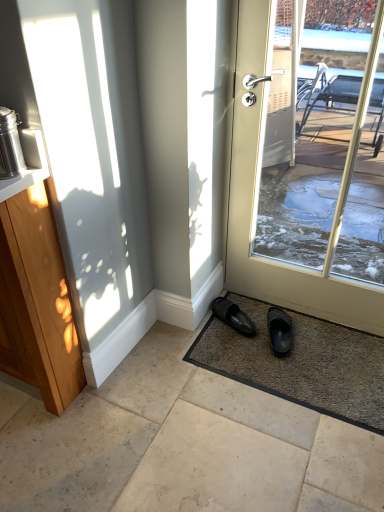
Question: Considering the positions of smooth beige tiles at center and black rubber slipper at lower center, the 2th footwear when ordered from right to left, in the image, is smooth beige tiles at center bigger or smaller than black rubber slipper at lower center, the 2th footwear when ordered from right to left,?

Choices:
 (A) small
 (B) big

Answer: (B)

Question: From a real-world perspective, is smooth beige tiles at center physically located above or below black rubber slipper at lower center, the 2th footwear when ordered from right to left?

Choices:
 (A) below
 (B) above

Answer: (A)

Question: Which object is positioned closest to the black rubber slipper at lower right, which appears as the second footwear when viewed from the left?

Choices:
 (A) stainless steel thermos at left
 (B) smooth beige tiles at center
 (C) wooden cabinet at left
 (D) matte white door at center
 (E) black rubber slipper at lower center, marked as the first footwear in a left-to-right arrangement

Answer: (E)

Question: Considering the real-world distances, which object is farthest from the black rubber slipper at lower center, the 2th footwear when ordered from right to left?

Choices:
 (A) smooth beige tiles at center
 (B) black rubber slipper at lower right, which is the 1th footwear in right-to-left order
 (C) brown textured mat at lower center
 (D) stainless steel thermos at left
 (E) wooden cabinet at left

Answer: (D)